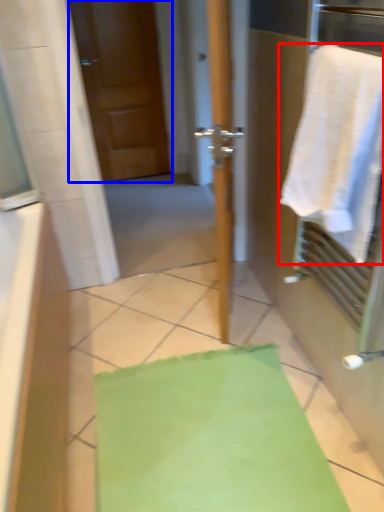
Question: Which point is further to the camera, towel (highlighted by a red box) or door (highlighted by a blue box)?

Choices:
 (A) towel
 (B) door

Answer: (B)